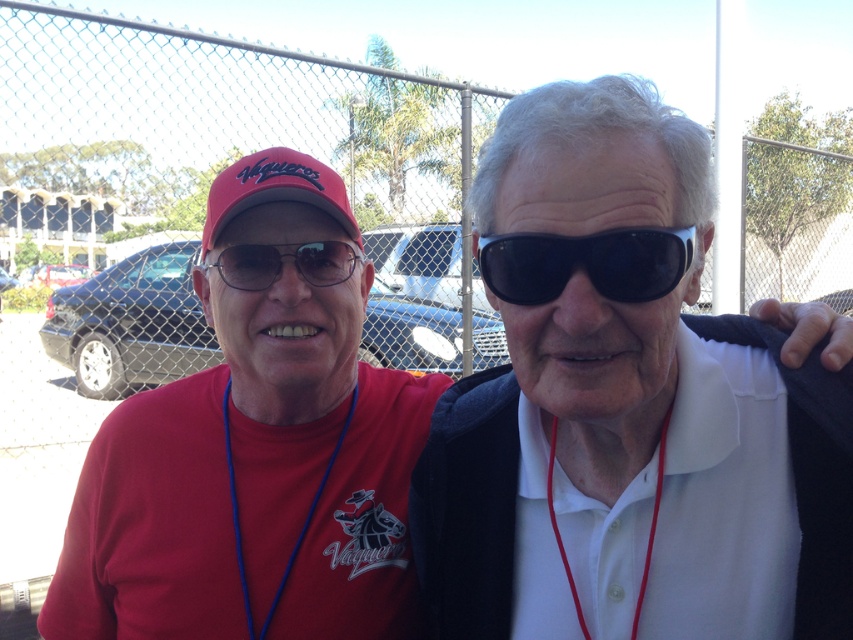
Looking at this image, can you confirm if white matte sunglasses at upper right is shorter than matte red baseball cap at upper left?

In fact, white matte sunglasses at upper right may be taller than matte red baseball cap at upper left.

The image size is (853, 640). What do you see at coordinates (630, 404) in the screenshot?
I see `white matte sunglasses at upper right` at bounding box center [630, 404].

This screenshot has width=853, height=640. What do you see at coordinates (630, 404) in the screenshot?
I see `white matte sunglasses at upper right` at bounding box center [630, 404].

Identify the location of white matte sunglasses at upper right. (630, 404).

Does white matte sunglasses at upper right appear on the right side of matte black goggles at center?

Indeed, white matte sunglasses at upper right is positioned on the right side of matte black goggles at center.

Is white matte sunglasses at upper right bigger than matte black goggles at center?

Yes.

Where is `white matte sunglasses at upper right`? white matte sunglasses at upper right is located at coordinates (630, 404).

What do you see at coordinates (585, 262) in the screenshot? The width and height of the screenshot is (853, 640). I see `black plastic sunglasses at upper center` at bounding box center [585, 262].

Does black plastic sunglasses at upper center appear on the left side of matte red baseball cap at upper left?

No, black plastic sunglasses at upper center is not to the left of matte red baseball cap at upper left.

Locate an element on the screen. black plastic sunglasses at upper center is located at coordinates (585, 262).